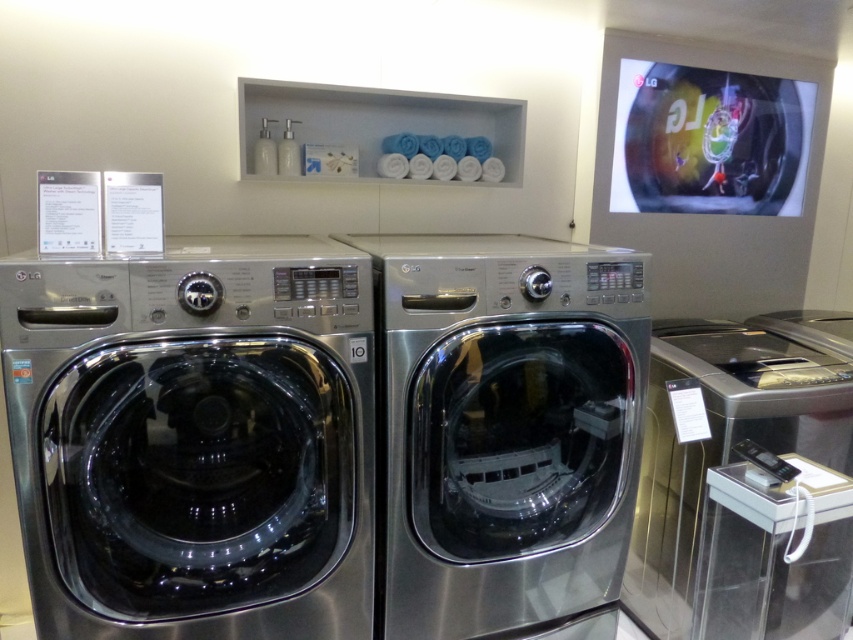
Does stainless steel dryer at center lie behind stainless steel dryer at right?

No, stainless steel dryer at center is in front of stainless steel dryer at right.

Which of these two, stainless steel dryer at center or stainless steel dryer at right, stands taller?

stainless steel dryer at center is taller.

The image size is (853, 640). In order to click on stainless steel dryer at center in this screenshot , I will do `click(503, 429)`.

Locate an element on the screen. stainless steel dryer at center is located at coordinates (503, 429).

Does stainless steel washing machine at left lie in front of stainless steel dryer at right?

Yes, stainless steel washing machine at left is closer to the viewer.

Is stainless steel washing machine at left further to the viewer compared to stainless steel dryer at right?

No, stainless steel washing machine at left is in front of stainless steel dryer at right.

Identify the location of stainless steel washing machine at left. Image resolution: width=853 pixels, height=640 pixels. (194, 438).

Where is `stainless steel washing machine at left`? Image resolution: width=853 pixels, height=640 pixels. stainless steel washing machine at left is located at coordinates pyautogui.click(x=194, y=438).

Who is higher up, stainless steel washing machine at left or stainless steel dryer at center?

stainless steel washing machine at left is above.

The width and height of the screenshot is (853, 640). What do you see at coordinates (194, 438) in the screenshot?
I see `stainless steel washing machine at left` at bounding box center [194, 438].

Image resolution: width=853 pixels, height=640 pixels. I want to click on stainless steel washing machine at left, so click(194, 438).